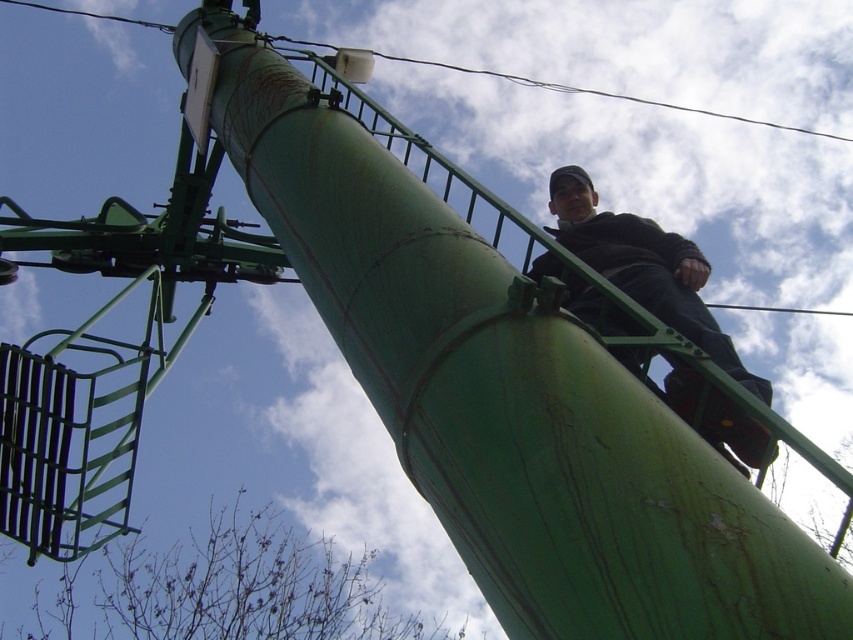
Between black matte jacket at upper right and green painted metal pole at upper center, which one appears on the right side from the viewer's perspective?

From the viewer's perspective, green painted metal pole at upper center appears more on the right side.

Who is taller, black matte jacket at upper right or green painted metal pole at upper center?

green painted metal pole at upper center

Describe the element at coordinates (643, 268) in the screenshot. I see `black matte jacket at upper right` at that location.

Identify the location of black matte jacket at upper right. (643, 268).